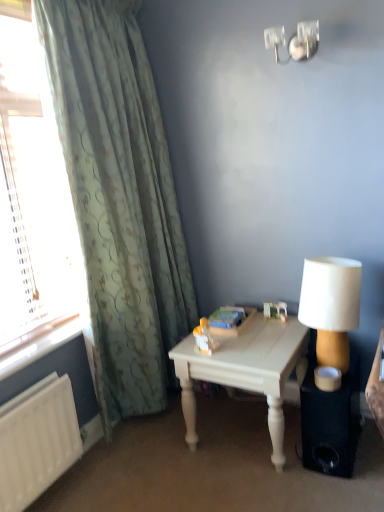
Find the location of a particular element. vacant area that is in front of white painted wood table at center is located at coordinates click(x=263, y=488).